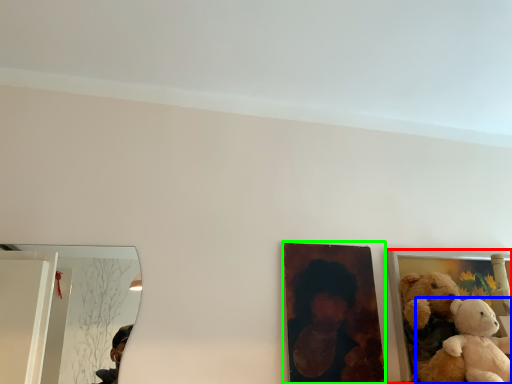
Question: Based on their relative distances, which object is farther from picture frame (highlighted by a red box)? Choose from teddy bear (highlighted by a blue box) and picture frame (highlighted by a green box).

Choices:
 (A) teddy bear
 (B) picture frame

Answer: (A)